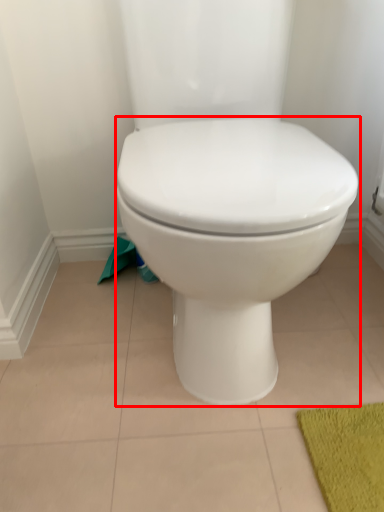
Question: From the image's perspective, what is the correct spatial relationship of toilet (annotated by the red box) in relation to toilet paper?

Choices:
 (A) above
 (B) below

Answer: (A)